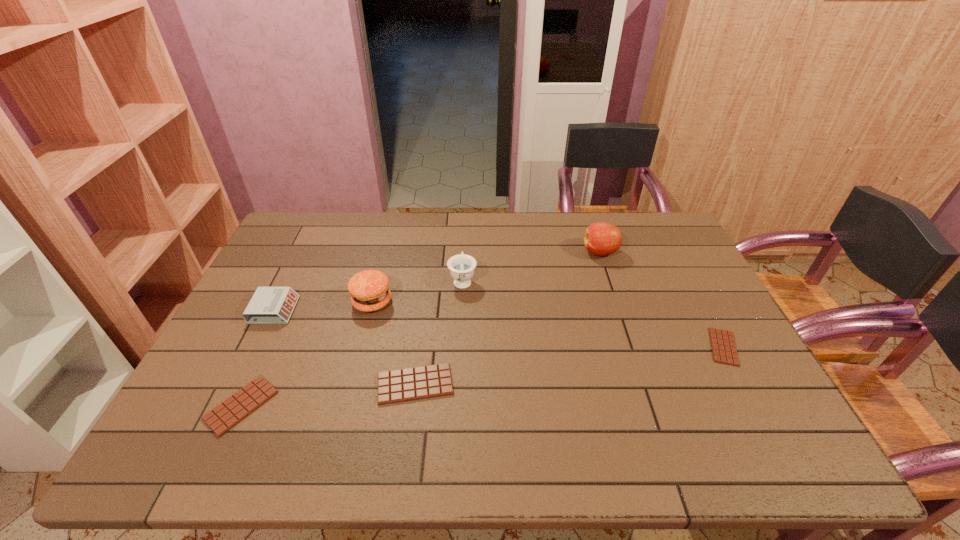
Locate an element on the screen. The width and height of the screenshot is (960, 540). the leftmost candy bar is located at coordinates (230, 412).

You are a GUI agent. You are given a task and a screenshot of the screen. Output one action in this format:
    pyautogui.click(x=<x>, y=<y>)
    Task: Click on the second shortest object
    Image resolution: width=960 pixels, height=540 pixels.
    Given the screenshot: What is the action you would take?
    pyautogui.click(x=230, y=412)

What are the coordinates of `the third shortest object` in the screenshot? It's located at (410, 384).

The height and width of the screenshot is (540, 960). I want to click on the tallest candy bar, so click(410, 384).

This screenshot has height=540, width=960. What are the coordinates of `the rightmost candy bar` in the screenshot? It's located at coord(724,351).

Image resolution: width=960 pixels, height=540 pixels. Identify the location of the shortest candy bar. (724, 351).

This screenshot has width=960, height=540. Identify the location of alarm clock. pyautogui.click(x=269, y=305).

Locate an element on the screen. the tallest object is located at coordinates (601, 238).

Locate an element on the screen. apple is located at coordinates (601, 238).

The height and width of the screenshot is (540, 960). I want to click on patty, so coord(369,290).